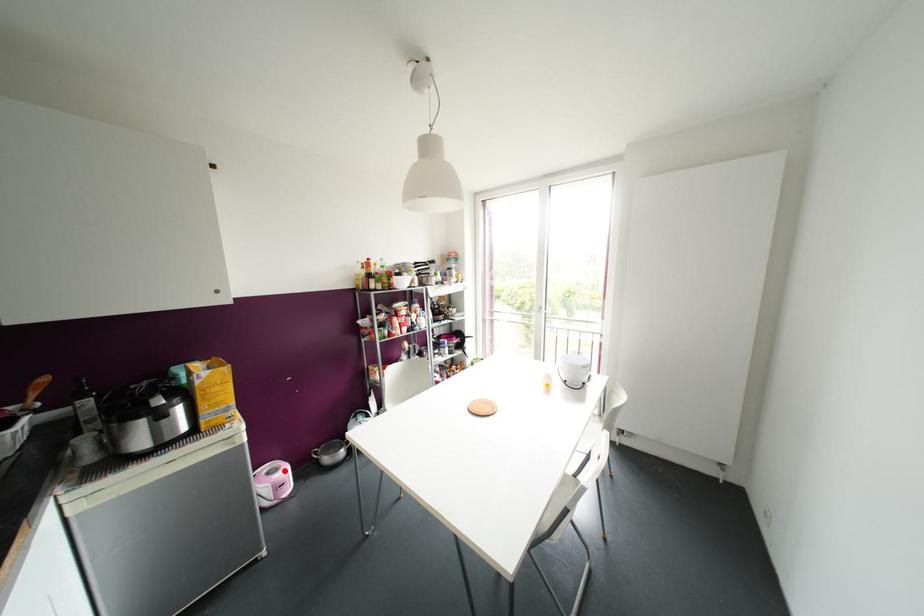
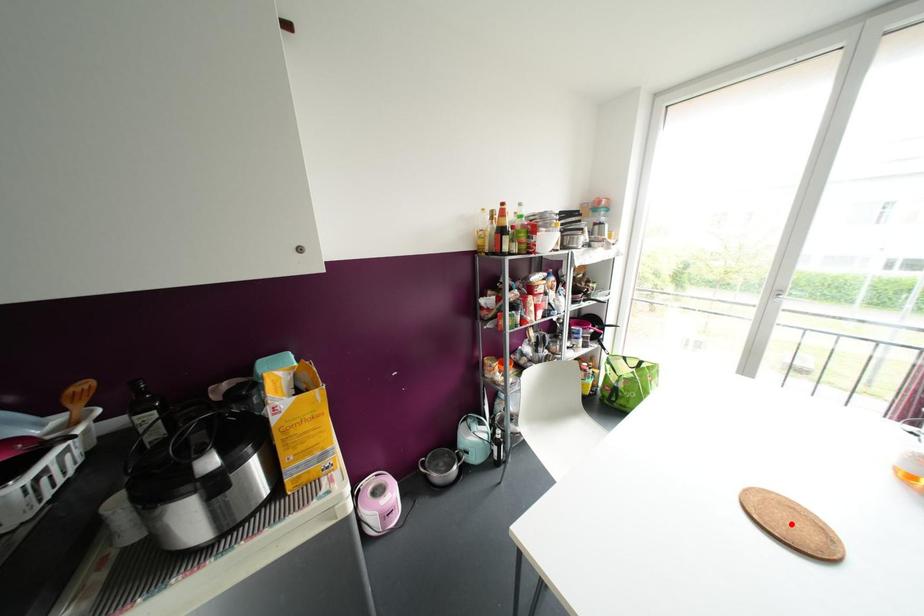
I am providing you with two images of the same scene from different viewpoints. A red point is marked on the first image and another point is marked on the second image. Do the highlighted points in image1 and image2 indicate the same real-world spot?

No